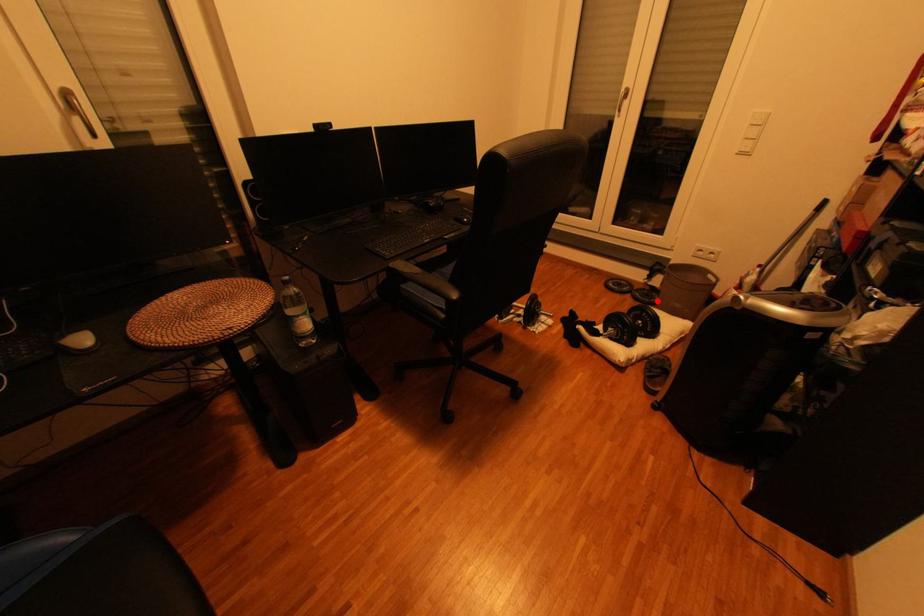
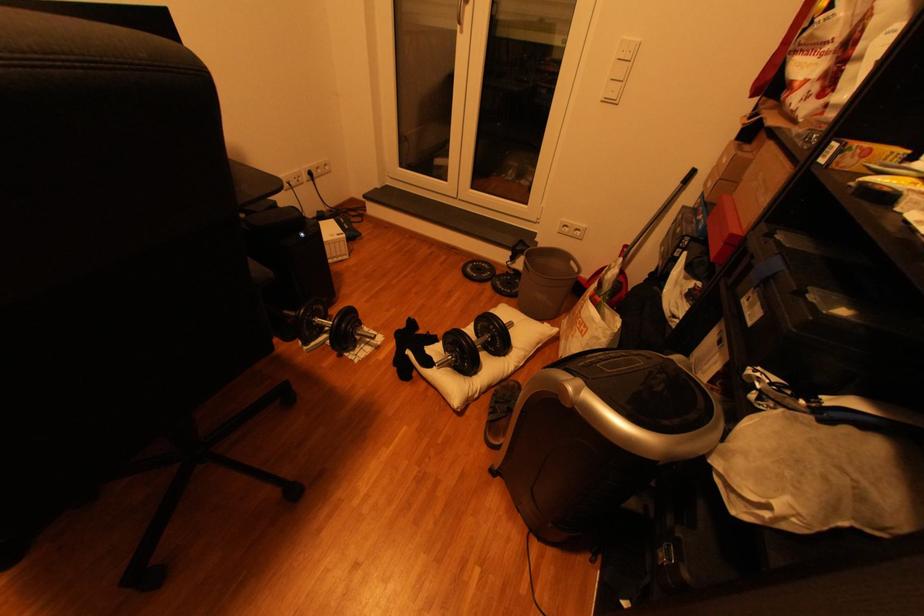
Question: I am providing you with two images of the same scene from different viewpoints. A red point is shown in image1. For the corresponding object point in image2, is it positioned nearer or farther from the camera?

Choices:
 (A) Nearer
 (B) Farther

Answer: (A)